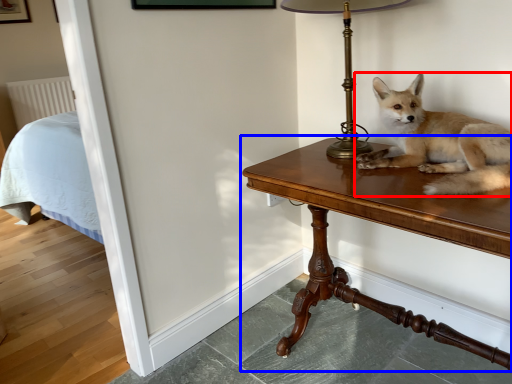
Question: Which point is closer to the camera, dog (highlighted by a red box) or table (highlighted by a blue box)?

Choices:
 (A) dog
 (B) table

Answer: (B)